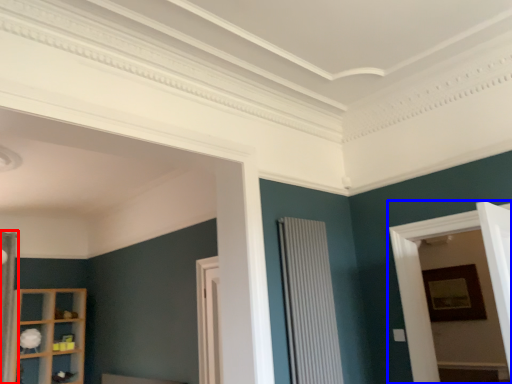
Question: Which point is closer to the camera, curtain (highlighted by a red box) or bay window (highlighted by a blue box)?

Choices:
 (A) curtain
 (B) bay window

Answer: (B)